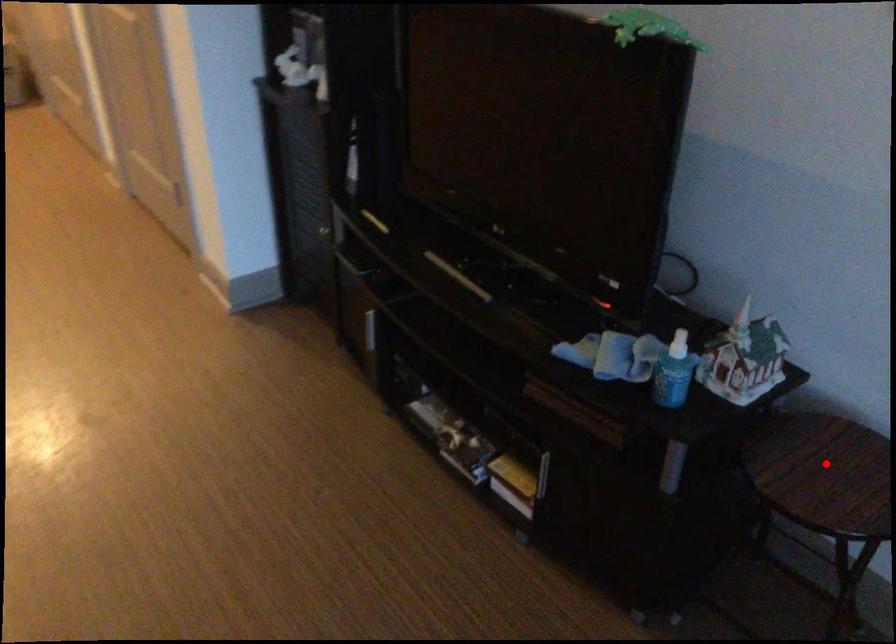
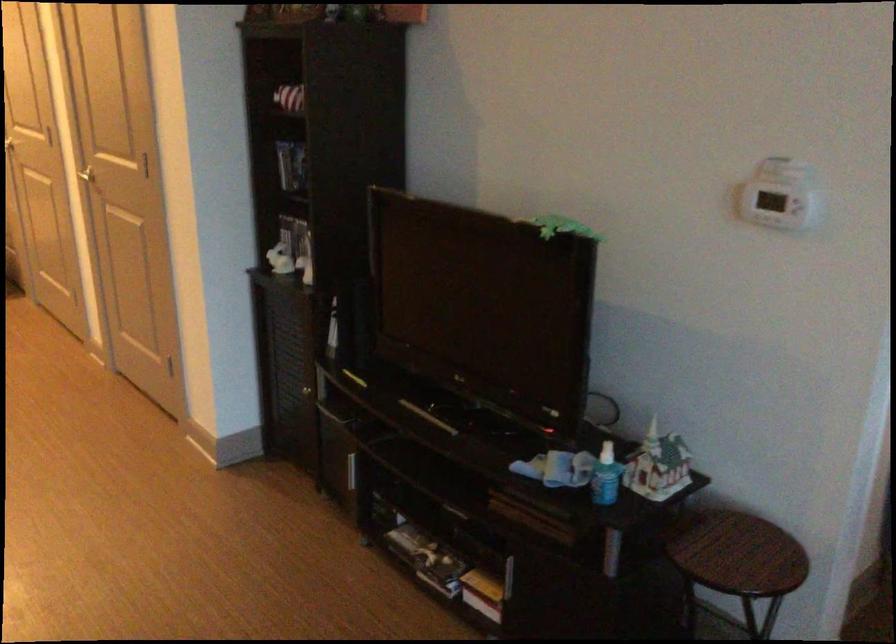
Locate, in the second image, the point that corresponds to the highlighted location in the first image.

(733, 547)